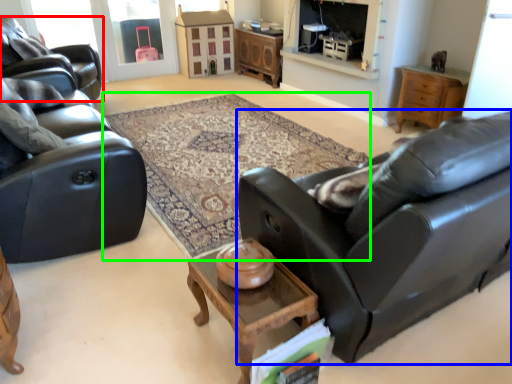
Question: Considering the real-world distances, which object is closest to chair (highlighted by a red box)? studio couch (highlighted by a blue box) or plain (highlighted by a green box).

Choices:
 (A) studio couch
 (B) plain

Answer: (B)